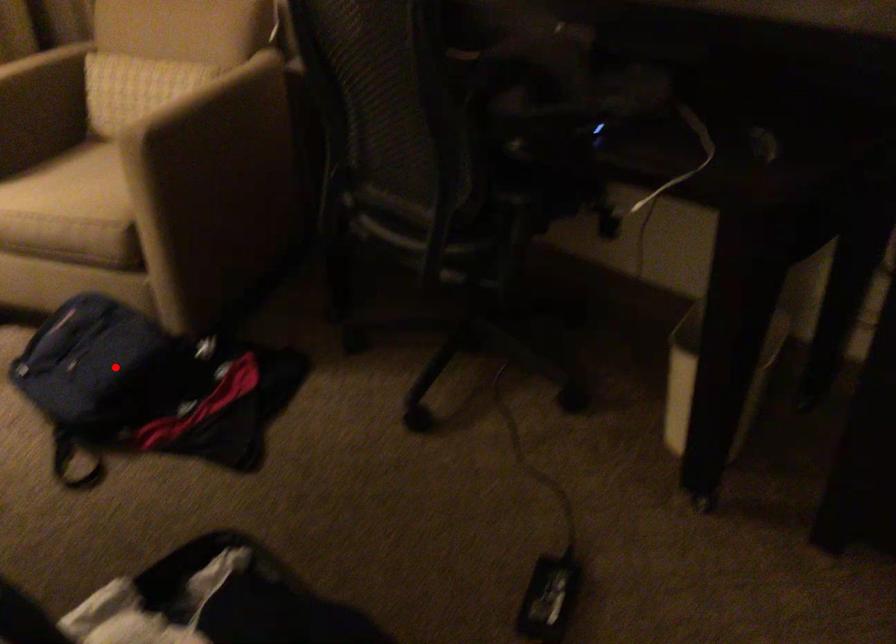
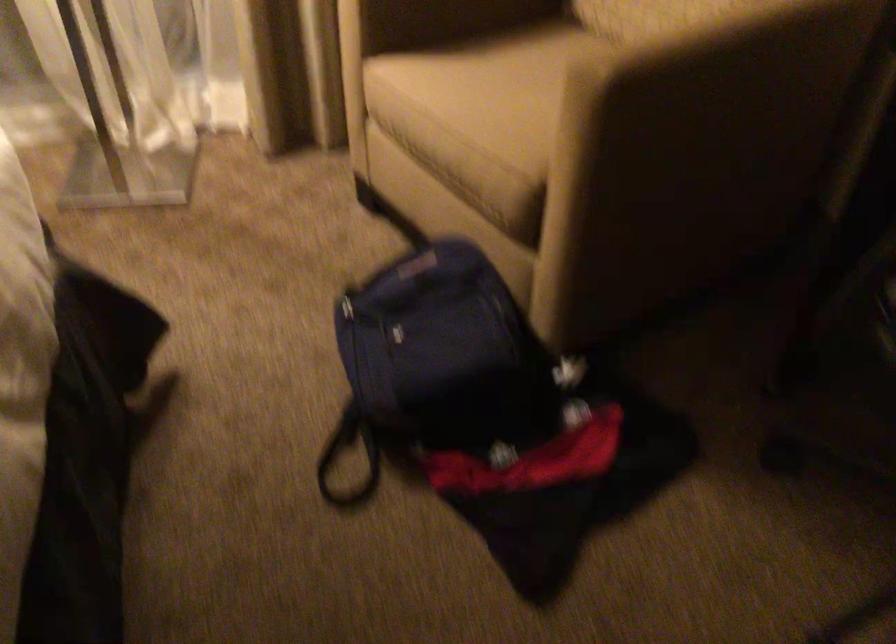
Question: I am providing you with two images of the same scene from different viewpoints. Image1 has a red point marked. In image2, the corresponding 3D location appears at what relative position? Reply with the corresponding letter.

Choices:
 (A) Closer
 (B) Farther

Answer: (A)